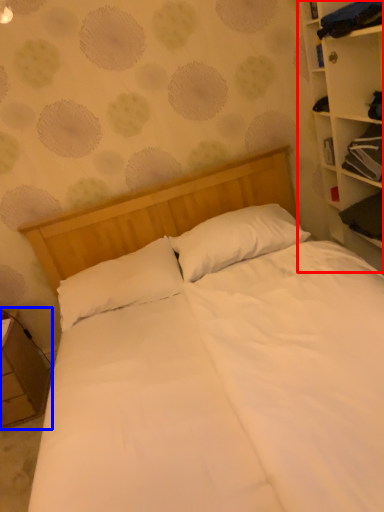
Question: Which object appears farthest to the camera in this image, bookcase (highlighted by a red box) or nightstand (highlighted by a blue box)?

Choices:
 (A) bookcase
 (B) nightstand

Answer: (B)